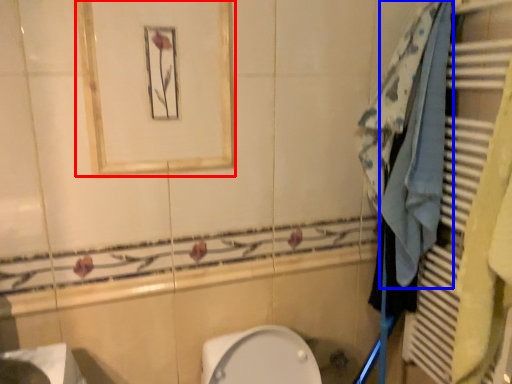
Question: Which of the following is the farthest to the observer, medicine cabinet (highlighted by a red box) or bath towel (highlighted by a blue box)?

Choices:
 (A) medicine cabinet
 (B) bath towel

Answer: (B)